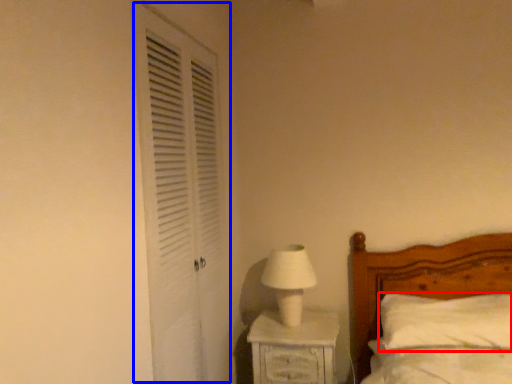
Question: Among these objects, which one is farthest to the camera, pillow (highlighted by a red box) or screen door (highlighted by a blue box)?

Choices:
 (A) pillow
 (B) screen door

Answer: (A)